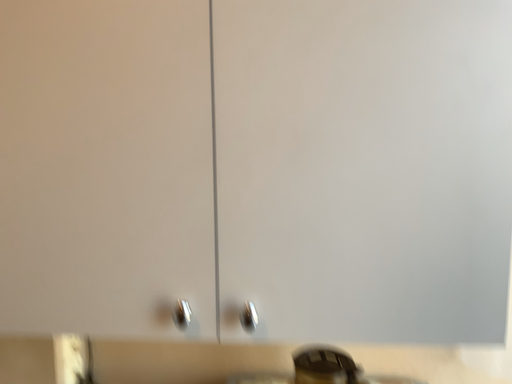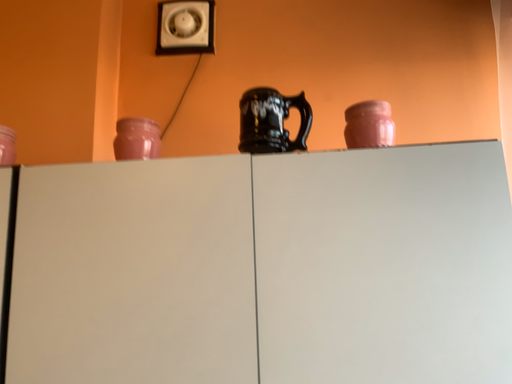
Question: Which way did the camera rotate in the video?

Choices:
 (A) rotated upward
 (B) rotated downward

Answer: (A)